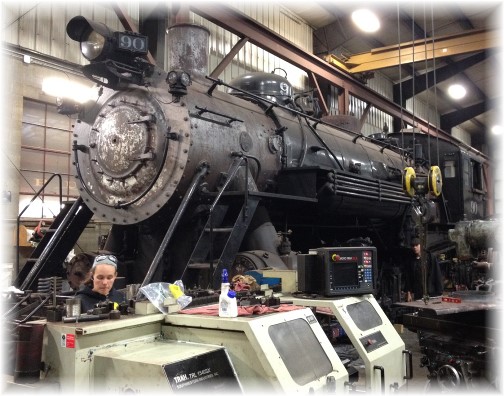
Identify the location of stairs. The image size is (504, 396). (196, 240).